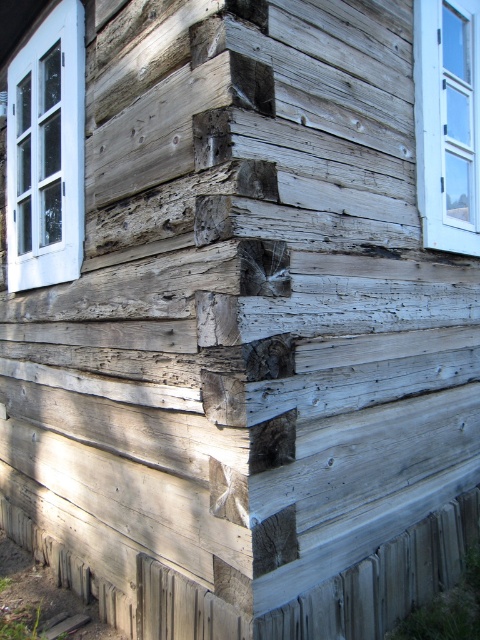
Question: Which object is farther from the camera taking this photo?

Choices:
 (A) white wooden window at upper left
 (B) white wood window at upper right

Answer: (A)

Question: Which of the following is the closest to the observer?

Choices:
 (A) white wooden window at upper left
 (B) white wood window at upper right

Answer: (B)

Question: Does white wooden window at upper left have a lesser width compared to white wood window at upper right?

Choices:
 (A) yes
 (B) no

Answer: (B)

Question: Can you confirm if white wooden window at upper left is positioned above white wood window at upper right?

Choices:
 (A) no
 (B) yes

Answer: (A)

Question: From the image, what is the correct spatial relationship of white wooden window at upper left in relation to white wood window at upper right?

Choices:
 (A) above
 (B) below

Answer: (B)

Question: Which of the following is the closest to the observer?

Choices:
 (A) (444, 28)
 (B) (8, 189)

Answer: (A)